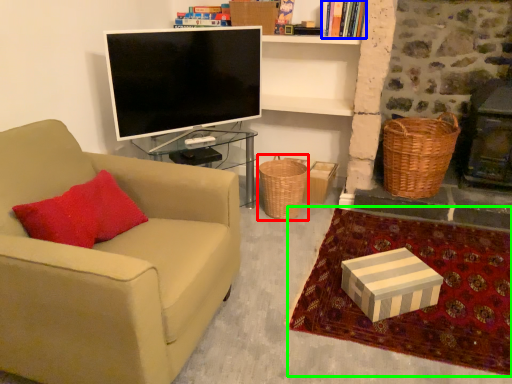
Question: Based on their relative distances, which object is nearer to basket (highlighted by a red box)? Choose from book (highlighted by a blue box) and blanket (highlighted by a green box).

Choices:
 (A) book
 (B) blanket

Answer: (B)